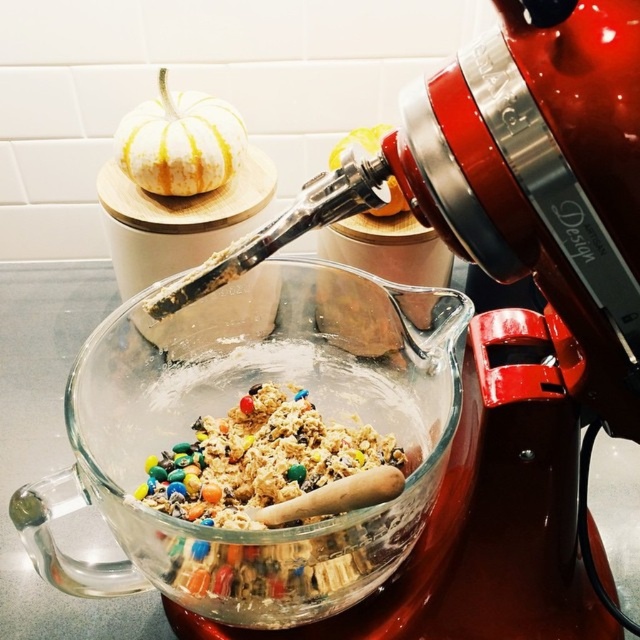
You are standing in the kitchen and want to reach the point at coordinates point (x=444, y=353). If your arm can extend 10 inches, will you be able to reach it?

The distance between you and the point (x=444, y=353) is 9.90 inches, so yes, you can reach it with your arm extended to 10 inches.

You are a baker trying to place the white matte pumpkin at upper left onto the transparent glass bowl at center. Is the pumpkin currently above or below the bowl?

The transparent glass bowl at center is positioned under the white matte pumpkin at upper left, so the pumpkin is currently above the bowl.